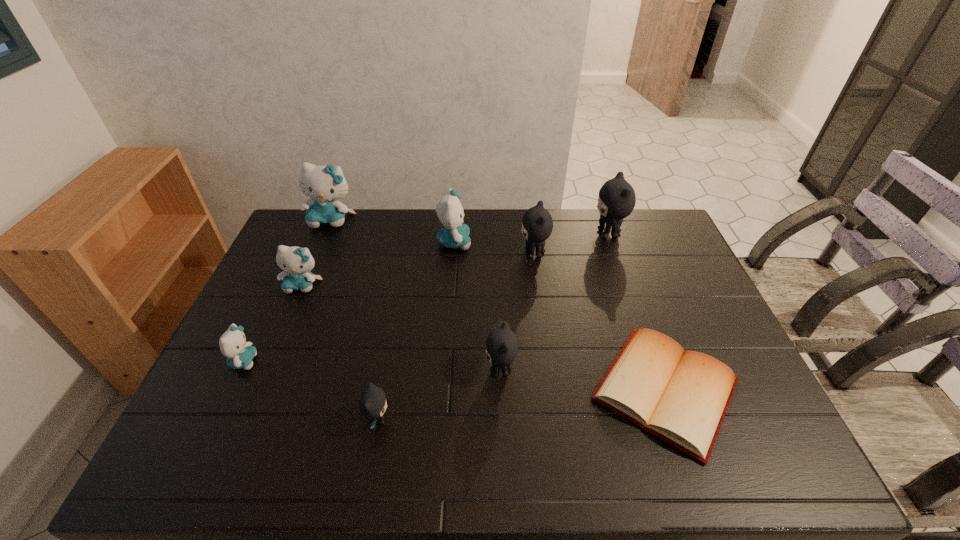
Locate an element on the screen. The image size is (960, 540). the biggest blue kitten is located at coordinates (323, 184).

What are the coordinates of `the rightmost gray kitten` in the screenshot? It's located at (616, 201).

Image resolution: width=960 pixels, height=540 pixels. Identify the location of the rightmost kitten. (616, 201).

The image size is (960, 540). Identify the location of the third smallest blue kitten. (454, 234).

Where is `the rightmost blue kitten`? the rightmost blue kitten is located at coordinates (454, 234).

Identify the location of the second kitten from right to left. (537, 224).

You are a GUI agent. You are given a task and a screenshot of the screen. Output one action in this format:
    pyautogui.click(x=<x>, y=<y>)
    Task: Click on the second biggest gray kitten
    The image size is (960, 540).
    Given the screenshot: What is the action you would take?
    pyautogui.click(x=537, y=224)

This screenshot has width=960, height=540. What are the coordinates of `the fifth nearest object` in the screenshot? It's located at (297, 263).

Find the location of `the third biggest blue kitten`. the third biggest blue kitten is located at coordinates 297,263.

Where is `the third farthest gray kitten`? This screenshot has height=540, width=960. the third farthest gray kitten is located at coordinates (501, 345).